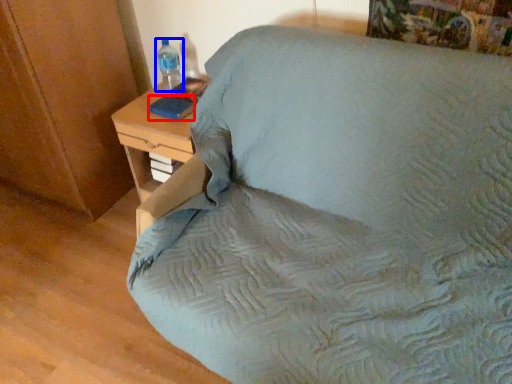
Question: Which point is closer to the camera, pad (highlighted by a red box) or bottle (highlighted by a blue box)?

Choices:
 (A) pad
 (B) bottle

Answer: (A)